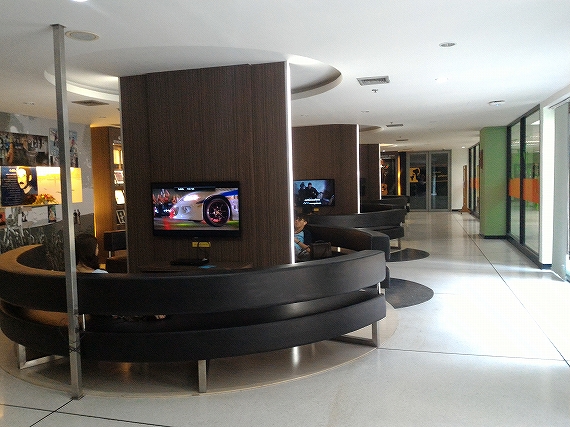
Identify the location of ceiling. This screenshot has height=427, width=570. (200, 10), (498, 46), (439, 99), (443, 131).